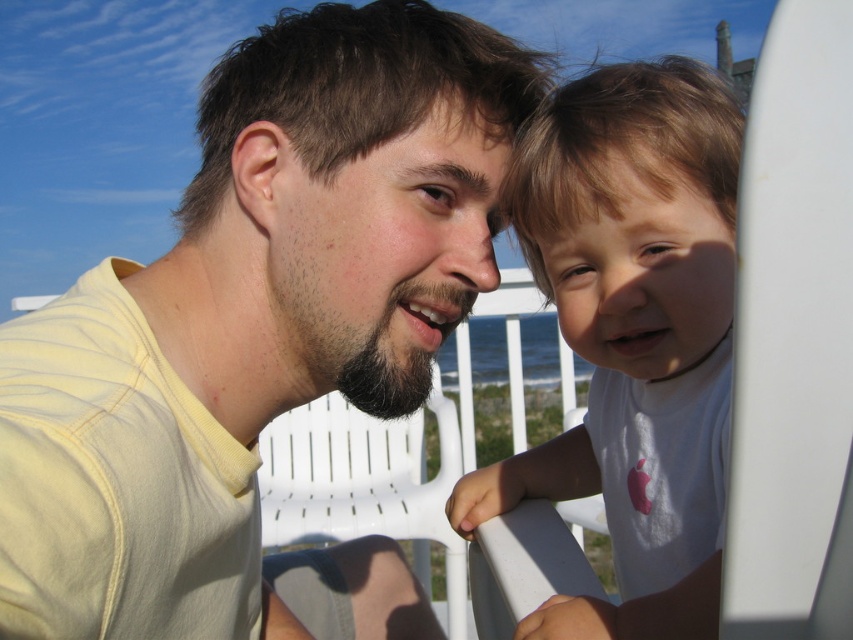
You are an observer standing in front of the image. You notice the yellow matte shirt at upper left and the white cotton shirt at right. Which shirt is positioned lower in the image?

The yellow matte shirt at upper left is below the white cotton shirt at right, so the yellow matte shirt at upper left is positioned lower in the image.